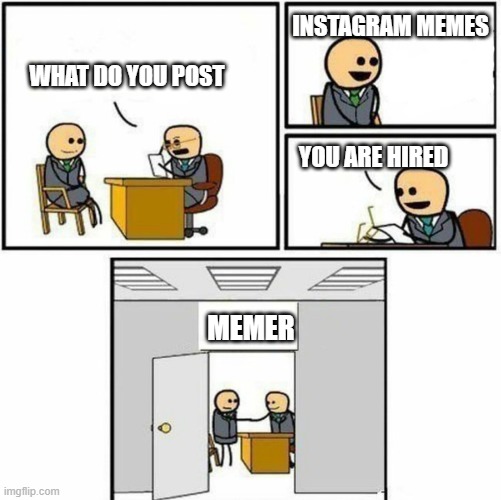
Find the location of a particular element. The width and height of the screenshot is (501, 500). desk chair is located at coordinates (217, 170), (210, 204), (470, 221).